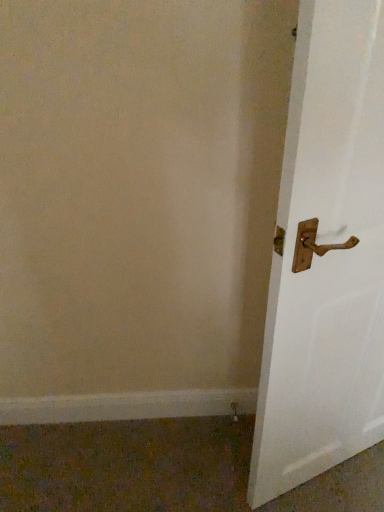
The image size is (384, 512). Identify the location of white glossy door at right. (326, 256).

The width and height of the screenshot is (384, 512). What do you see at coordinates (326, 256) in the screenshot?
I see `white glossy door at right` at bounding box center [326, 256].

The height and width of the screenshot is (512, 384). Find the location of `white glossy door at right`. white glossy door at right is located at coordinates (326, 256).